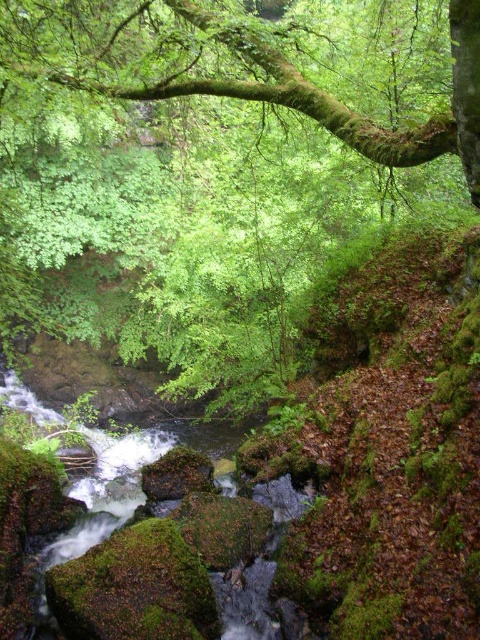
Question: Which of the following is the closest to the observer?

Choices:
 (A) (103, 92)
 (B) (182, 424)

Answer: (A)

Question: Which of the following is the farthest from the observer?

Choices:
 (A) green mossy branch at upper center
 (B) green mossy water at center

Answer: (B)

Question: Does green mossy branch at upper center have a larger size compared to green mossy water at center?

Choices:
 (A) no
 (B) yes

Answer: (A)

Question: Does green mossy branch at upper center appear under green mossy water at center?

Choices:
 (A) no
 (B) yes

Answer: (A)

Question: Is green mossy branch at upper center smaller than green mossy water at center?

Choices:
 (A) no
 (B) yes

Answer: (B)